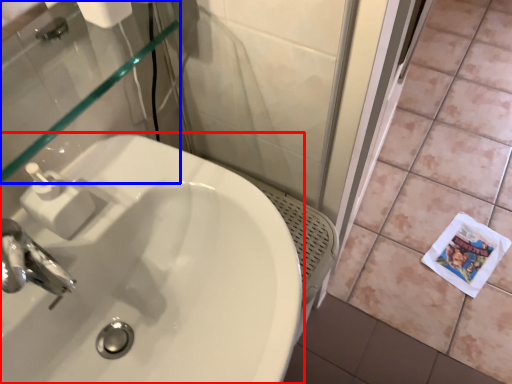
Question: Among these objects, which one is nearest to the camera, sink (highlighted by a red box) or mirror (highlighted by a blue box)?

Choices:
 (A) sink
 (B) mirror

Answer: (A)